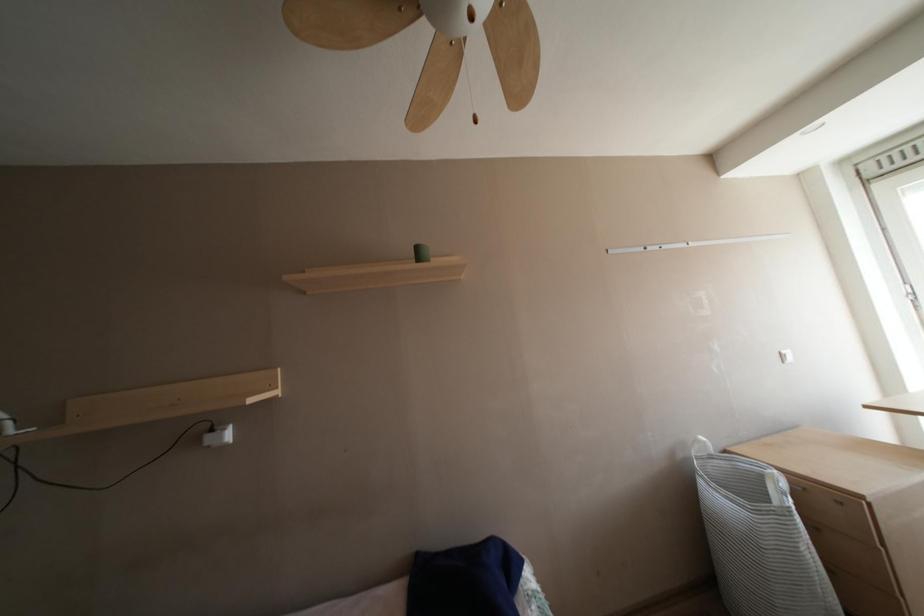
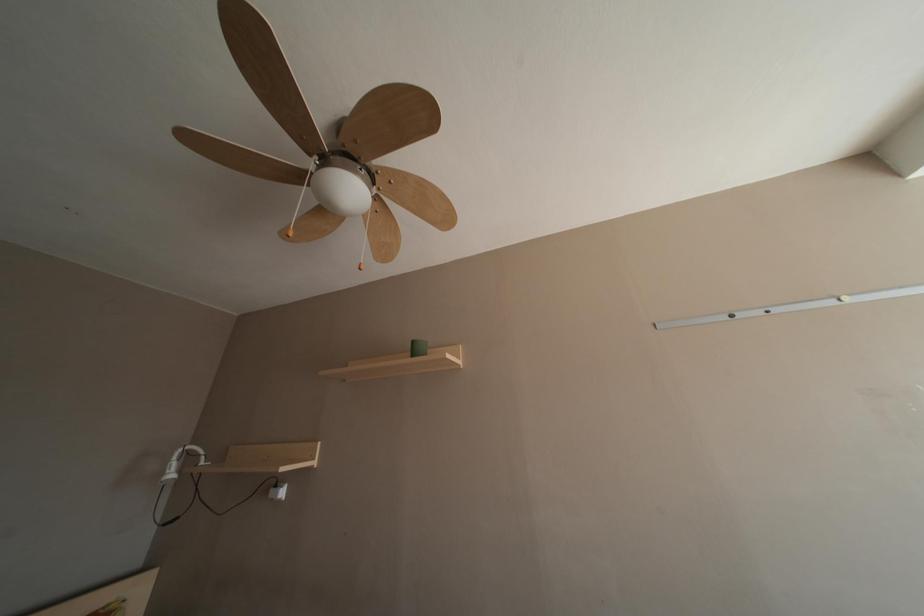
Question: The camera is either moving clockwise (left) or counter-clockwise (right) around the object. The first image is from the beginning of the video and the second image is from the end. Is the camera moving left or right when shooting the video?

Choices:
 (A) Left
 (B) Right

Answer: (B)